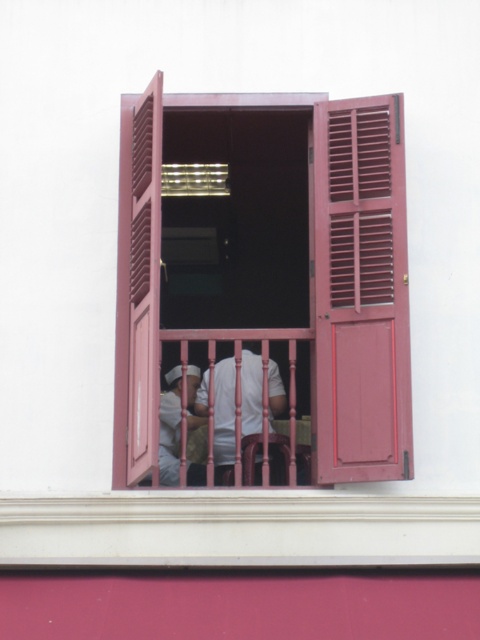
Question: Among these objects, which one is farthest from the camera?

Choices:
 (A) white matte uniform at center
 (B) matte wood window at center

Answer: (A)

Question: Which point is farther to the camera?

Choices:
 (A) pink wooden rail at center
 (B) matte wood window at center
 (C) matte wood shutter at right
 (D) white matte uniform at center

Answer: (D)

Question: From the image, what is the correct spatial relationship of matte wood shutter at right in relation to white matte uniform at center?

Choices:
 (A) below
 (B) above

Answer: (B)

Question: Does matte wood window at center have a greater width compared to pink wooden rail at center?

Choices:
 (A) yes
 (B) no

Answer: (A)

Question: Does matte wood shutter at right have a larger size compared to white matte uniform at center?

Choices:
 (A) yes
 (B) no

Answer: (B)

Question: Which point is farther to the camera?

Choices:
 (A) (368, 172)
 (B) (368, 182)

Answer: (A)